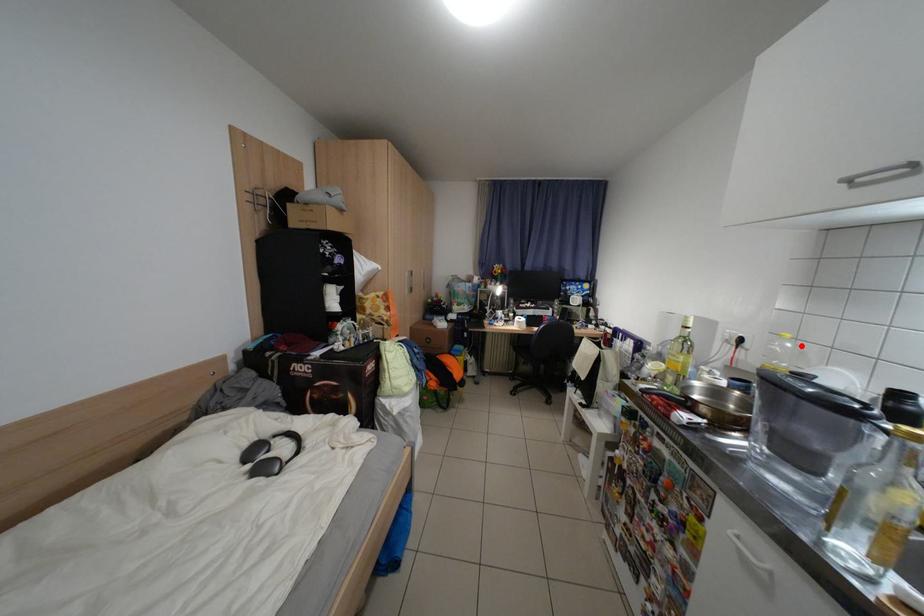
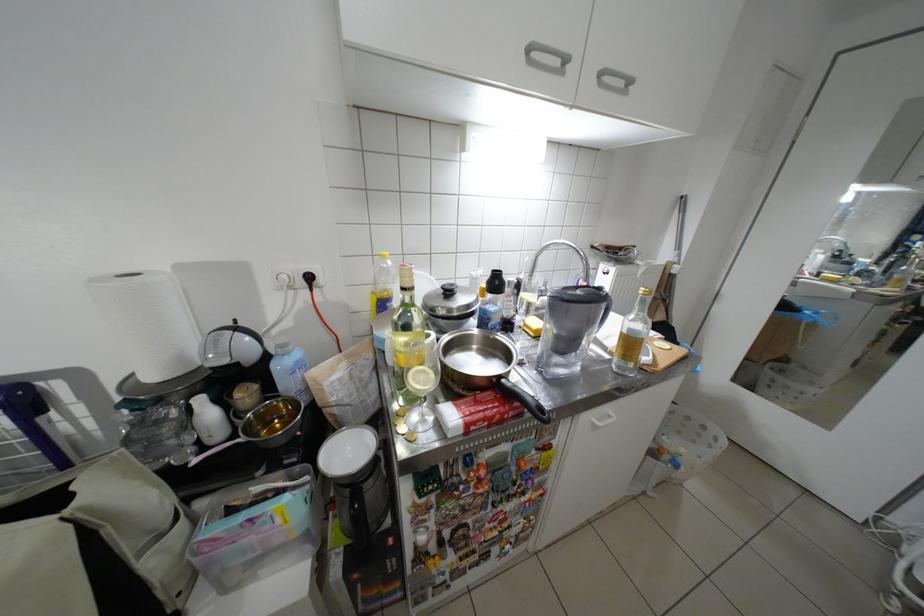
Find the pixel in the second image that matches the highlighted location in the first image.

(400, 264)